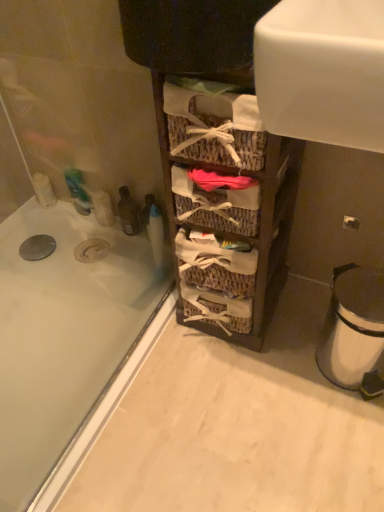
Question: From the image's perspective, relative to woven wood baskets at center, is white glossy bathtub at lower left above or below?

Choices:
 (A) above
 (B) below

Answer: (B)

Question: Would you say white glossy bathtub at lower left is to the left or to the right of woven wood baskets at center in the picture?

Choices:
 (A) left
 (B) right

Answer: (A)

Question: Which object is the closest to the woven wood baskets at center?

Choices:
 (A) white glossy bathtub at lower left
 (B) white metallic trash can at lower right

Answer: (B)

Question: Considering the real-world distances, which object is farthest from the white glossy bathtub at lower left?

Choices:
 (A) woven wood baskets at center
 (B) white metallic trash can at lower right

Answer: (B)